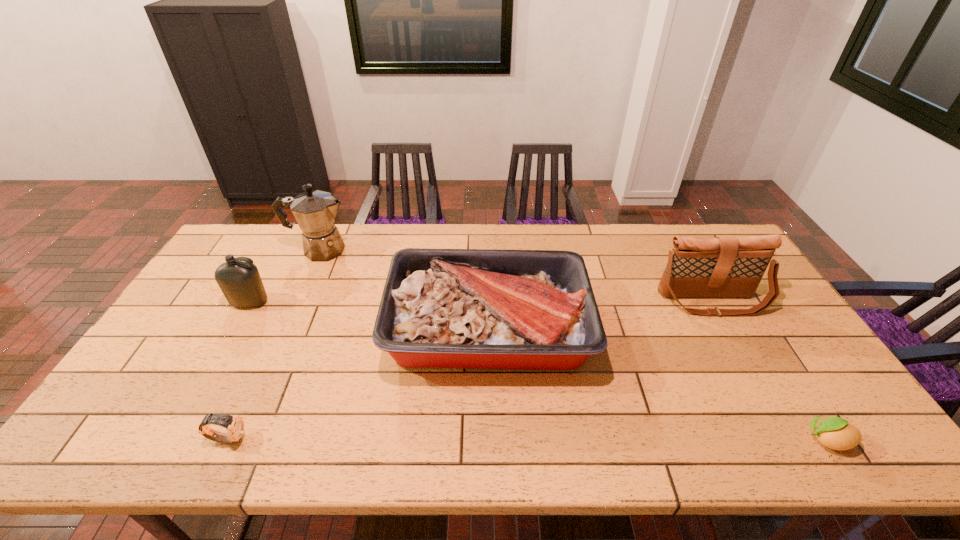
Image resolution: width=960 pixels, height=540 pixels. Identify the location of object located in the near right corner section of the desktop. (836, 433).

In order to click on vacant space at the far edge of the desktop in this screenshot , I will do `click(643, 246)`.

Find the location of a particular element. vacant point at the near edge is located at coordinates (775, 448).

In the image, there is a desktop. Identify the location of free region at the left edge. The height and width of the screenshot is (540, 960). (223, 316).

I want to click on vacant space at the right edge of the desktop, so click(732, 303).

The width and height of the screenshot is (960, 540). Find the location of `vacant space at the far left corner`. vacant space at the far left corner is located at coordinates (248, 248).

Locate an element on the screen. vacant point located between the watch and the bottle is located at coordinates (239, 370).

At what (x,y) coordinates should I click in order to perform the action: click on vacant space in between the tray and the watch. Please return your answer as a coordinate pair (x, y). Looking at the image, I should click on (358, 383).

I want to click on vacant area that lies between the fourth object from left to right and the lemon, so click(x=658, y=384).

Identify the location of free point between the tray and the lemon. The width and height of the screenshot is (960, 540). (658, 384).